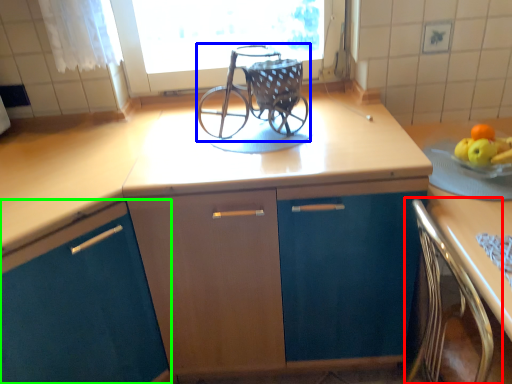
Question: Which is farther away from chair (highlighted by a red box)? baby carriage (highlighted by a blue box) or cabinetry (highlighted by a green box)?

Choices:
 (A) baby carriage
 (B) cabinetry

Answer: (B)